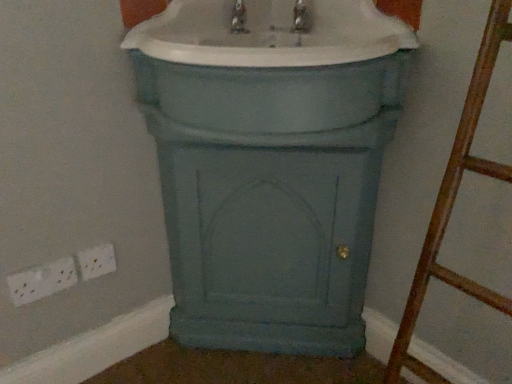
Question: Is point (316, 99) closer or farther from the camera than point (100, 258)?

Choices:
 (A) closer
 (B) farther

Answer: (A)

Question: Is matte blue cabinet at center in front of or behind white plastic electric outlet at lower left, the 2th electric outlet when ordered from left to right, in the image?

Choices:
 (A) front
 (B) behind

Answer: (A)

Question: Estimate the real-world distances between objects in this image. Which object is farther from the white plastic electric outlet at lower left, the first electric outlet positioned from the right?

Choices:
 (A) white plastic socket at lower left, the 1th electric outlet in the left-to-right sequence
 (B) matte blue cabinet at center
 (C) matte blue cabinet at center

Answer: (C)

Question: Estimate the real-world distances between objects in this image. Which object is closer to the matte blue cabinet at center?

Choices:
 (A) white plastic electric outlet at lower left, the 2th electric outlet when ordered from left to right
 (B) white plastic socket at lower left, the 1th electric outlet in the left-to-right sequence
 (C) matte blue cabinet at center

Answer: (C)